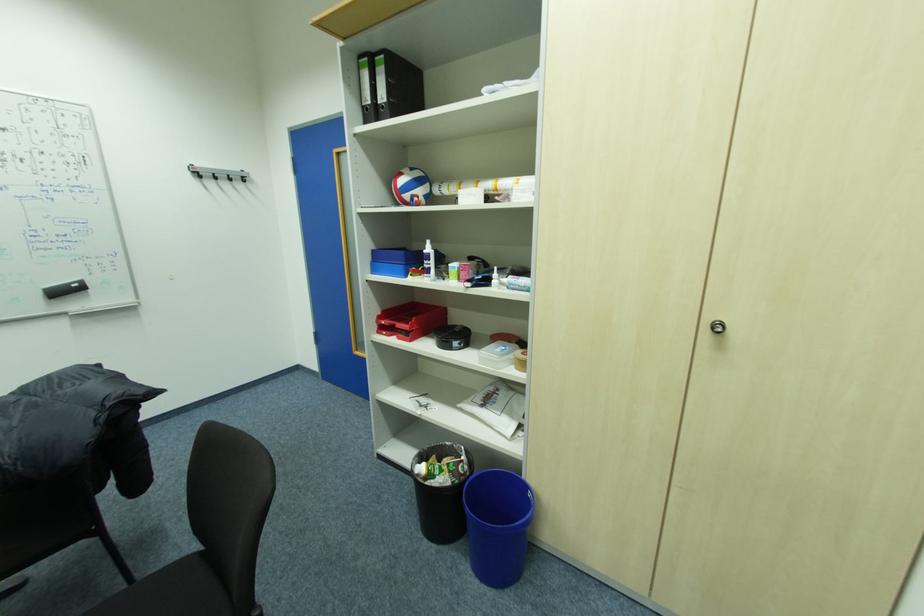
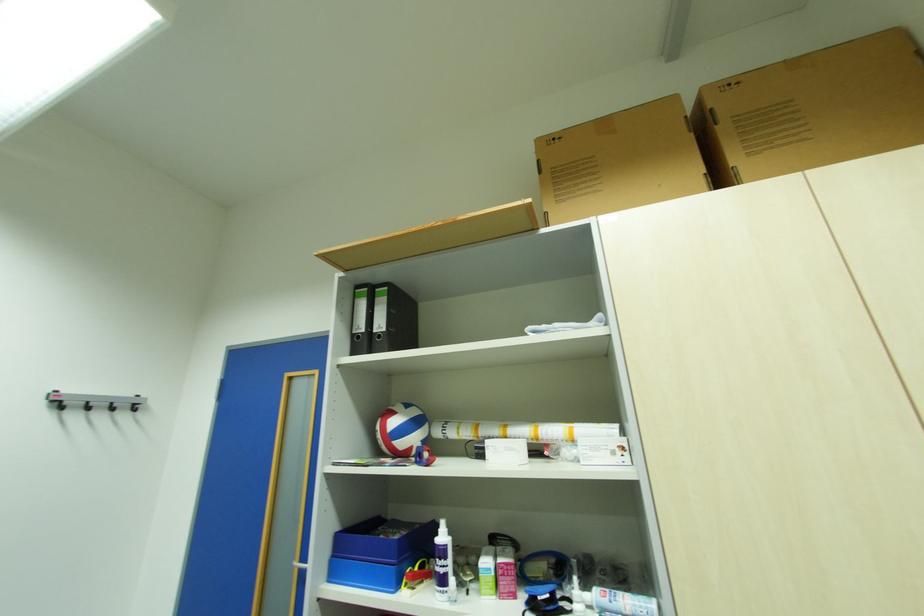
First-person continuous shooting, in which direction is the camera rotating?

The camera rotated toward right-up.